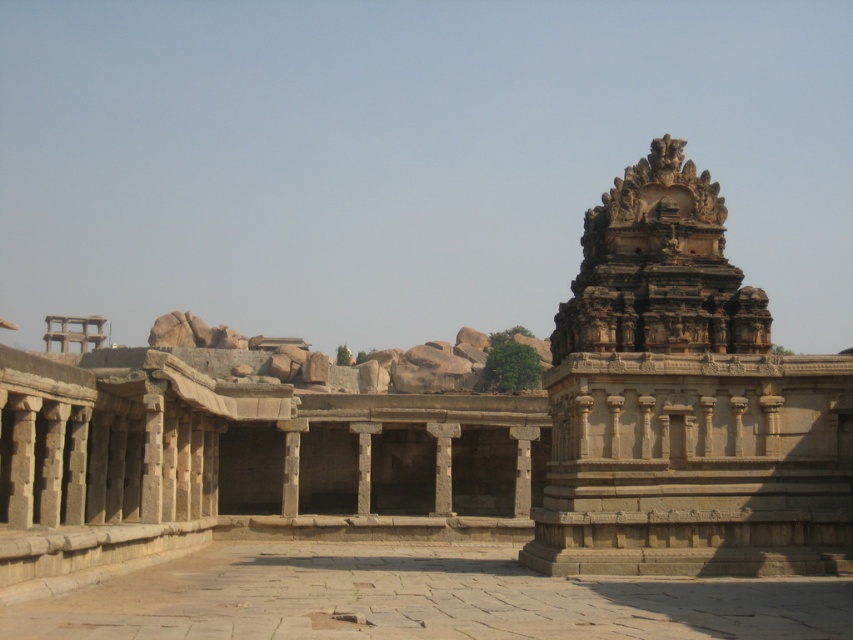
Does stone temple at right have a greater width compared to smooth stone courtyard at center?

No, stone temple at right is not wider than smooth stone courtyard at center.

In the scene shown: Is the position of stone temple at right more distant than that of smooth stone courtyard at center?

Yes, it is behind smooth stone courtyard at center.

Is point (663, 193) positioned behind point (173, 600)?

Yes.

Identify the location of stone temple at right. Image resolution: width=853 pixels, height=640 pixels. (685, 403).

Is stone temple at center positioned in front of smooth stone courtyard at center?

No, stone temple at center is further to the viewer.

Does stone temple at center have a lesser width compared to smooth stone courtyard at center?

No, stone temple at center is not thinner than smooth stone courtyard at center.

Is point (106, 435) closer to camera compared to point (331, 582)?

No, it is behind (331, 582).

You are a GUI agent. You are given a task and a screenshot of the screen. Output one action in this format:
    pyautogui.click(x=<x>, y=<y>)
    Task: Click on the stone temple at center
    
    Given the screenshot: What is the action you would take?
    pyautogui.click(x=462, y=428)

Does stone temple at center lie in front of stone temple at right?

Yes.

Which is behind, point (564, 442) or point (605, 500)?

The point (564, 442) is more distant.

Where is `stone temple at center`? The width and height of the screenshot is (853, 640). stone temple at center is located at coordinates (462, 428).